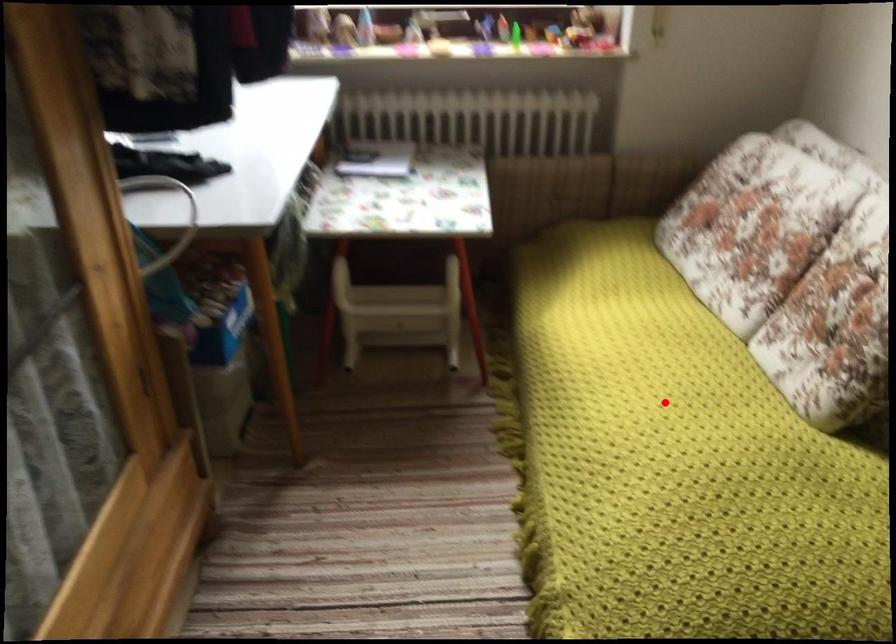
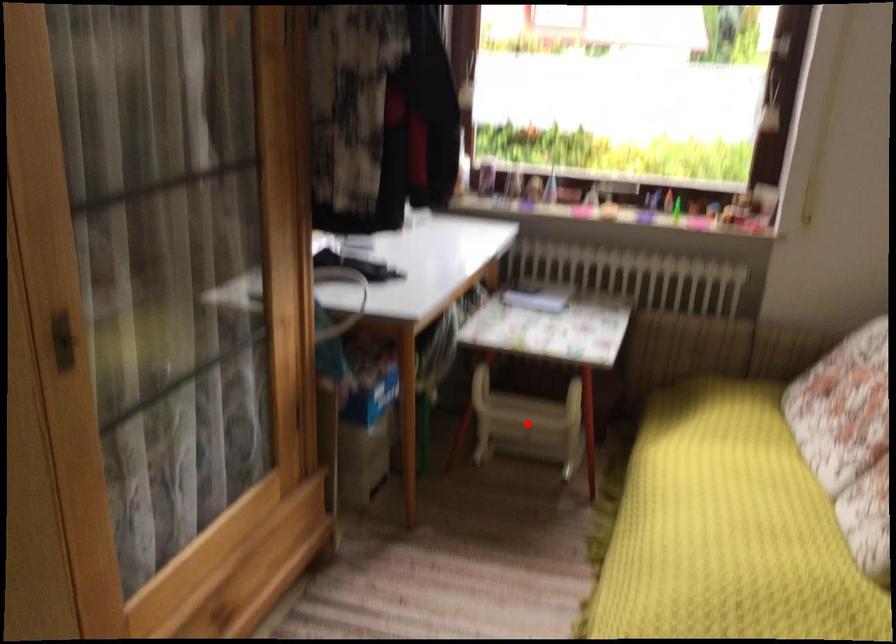
I am providing you with two images of the same scene from different viewpoints. A red point is marked on the first image and another point is marked on the second image. Are the points marked in image1 and image2 representing the same 3D position?

No